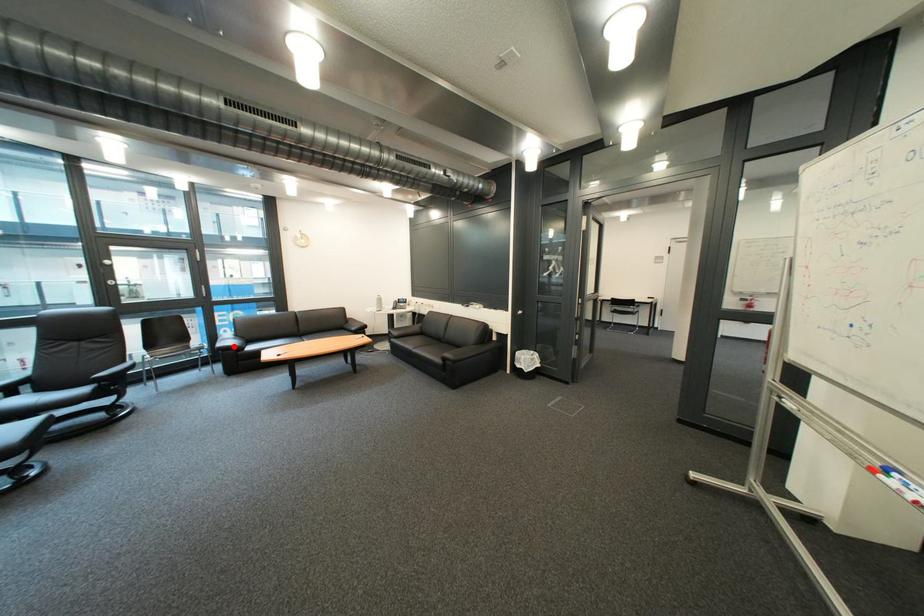
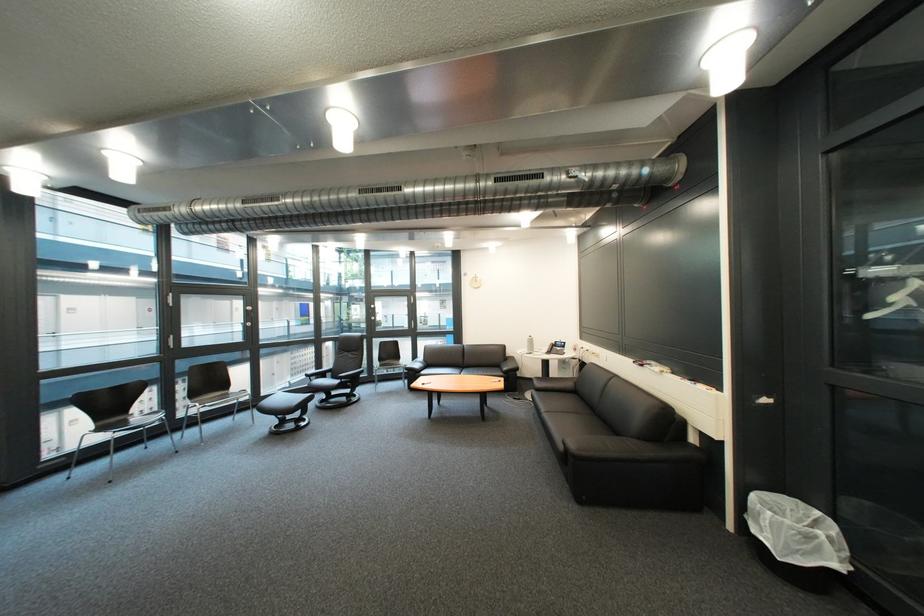
Locate, in the second image, the point that corresponds to the highlighted location in the first image.

(423, 367)